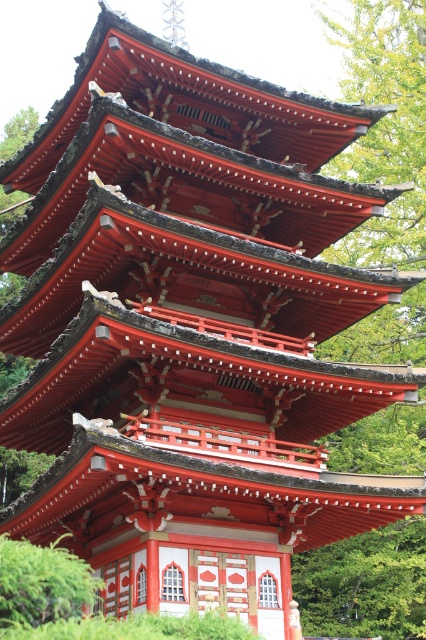
Question: Among these objects, which one is farthest from the camera?

Choices:
 (A) green leafy tree at upper center
 (B) green leafy bush at lower left

Answer: (A)

Question: Which point appears closest to the camera in this image?

Choices:
 (A) (83, 596)
 (B) (414, 440)

Answer: (A)

Question: Is green leafy tree at upper center further to camera compared to green leafy bush at lower left?

Choices:
 (A) yes
 (B) no

Answer: (A)

Question: Is green leafy tree at upper center thinner than green leafy bush at lower left?

Choices:
 (A) no
 (B) yes

Answer: (A)

Question: Can you confirm if green leafy tree at upper center is positioned below green leafy bush at lower left?

Choices:
 (A) yes
 (B) no

Answer: (B)